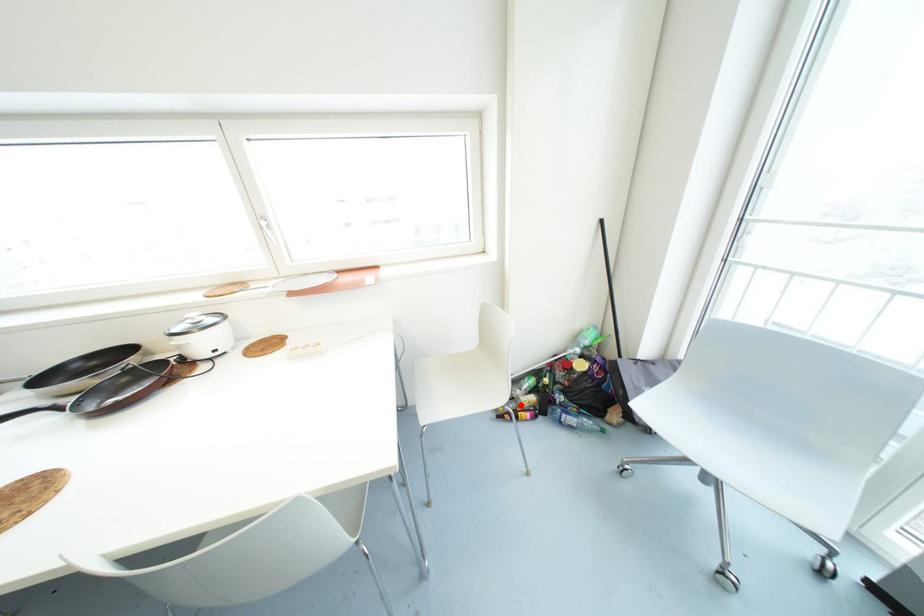
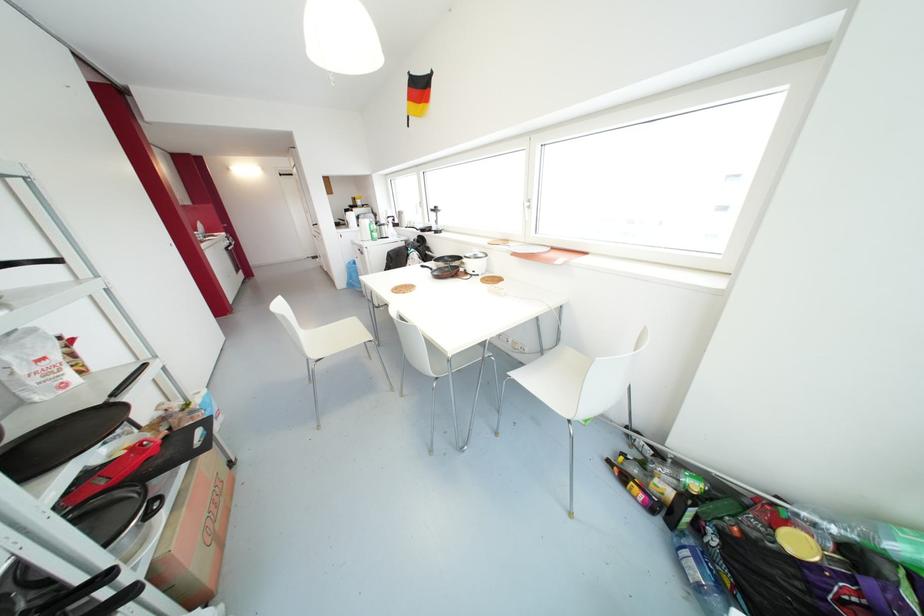
The point at the highlighted location is marked in the first image. Where is the corresponding point in the second image?

(648, 484)